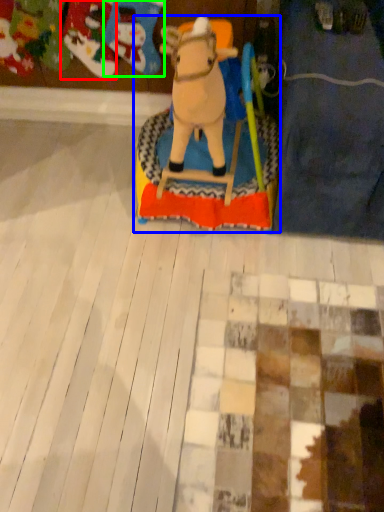
Question: Which object is the farthest from toy (highlighted by a red box)? Choose among these: toy (highlighted by a blue box) or toy (highlighted by a green box).

Choices:
 (A) toy
 (B) toy

Answer: (A)